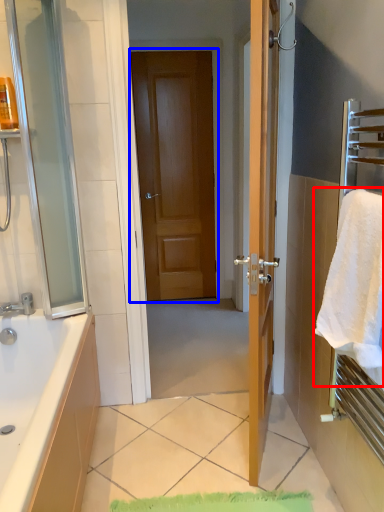
Question: Which object is further to the camera taking this photo, beach towel (highlighted by a red box) or door (highlighted by a blue box)?

Choices:
 (A) beach towel
 (B) door

Answer: (B)